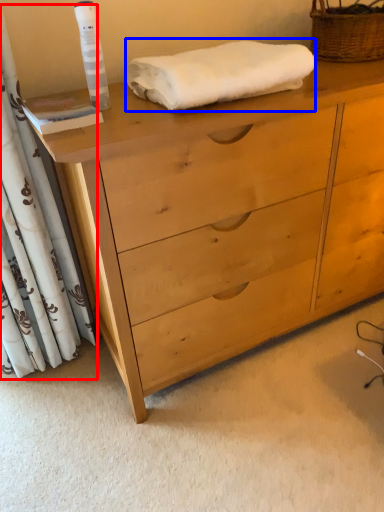
Question: Which point is closer to the camera, curtain (highlighted by a red box) or bath towel (highlighted by a blue box)?

Choices:
 (A) curtain
 (B) bath towel

Answer: (A)